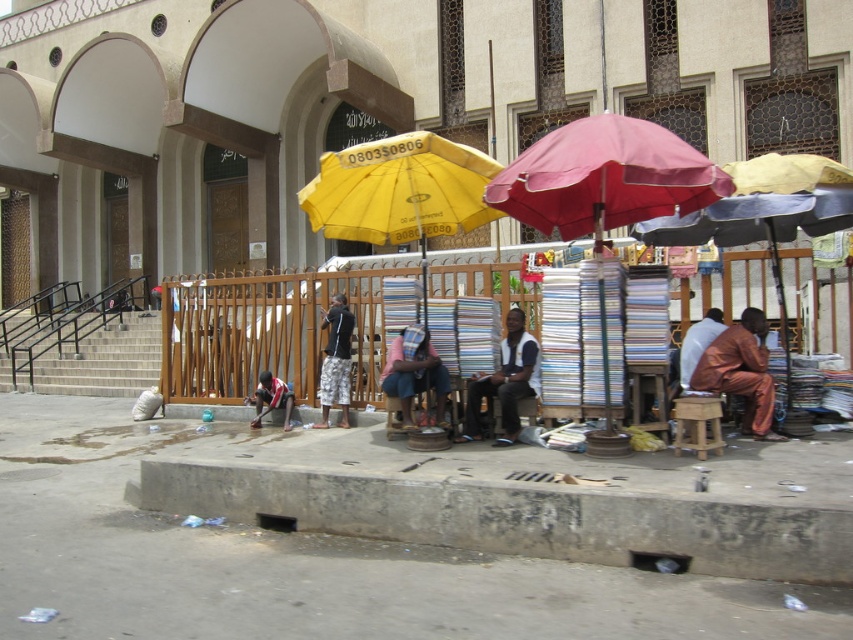
You are a delivery person trying to avoid getting wet in a sudden rain shower. You see a matte red umbrella at center and dark gray fabric pants at center. Which item can you use to stay dry?

The matte red umbrella at center is above dark gray fabric pants at center, so you can use the matte red umbrella at center to stay dry.

Based on the photo, you are a delivery person trying to navigate through the market area. You need to pass between the concrete pavement at lower center and the yellow fabric umbrella at center. Which object is lower and can you walk under it comfortably?

The concrete pavement at lower center has a lesser height compared to the yellow fabric umbrella at center. Since the concrete pavement is lower, you can comfortably walk under it as it is closer to the ground.

You are a delivery person who needs to place a matte red umbrella at center and dark gray fabric pants at center into a box. The box can only fit one of the items. Which item should you choose based on their size?

The matte red umbrella at center is bigger than the dark gray fabric pants at center, so you should choose the dark gray fabric pants at center to fit into the box.